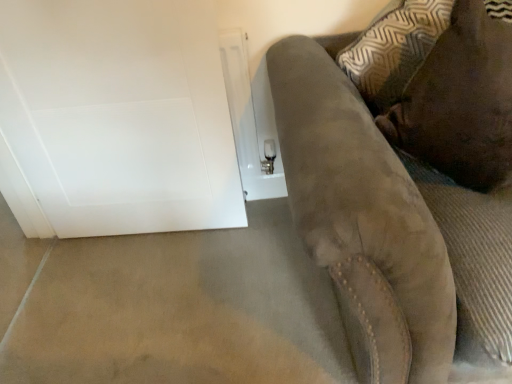
At what (x,y) coordinates should I click in order to perform the action: click on free space underneath white glossy door at left (from a real-world perspective). Please return your answer as a coordinate pair (x, y). Image resolution: width=512 pixels, height=384 pixels. Looking at the image, I should click on (150, 236).